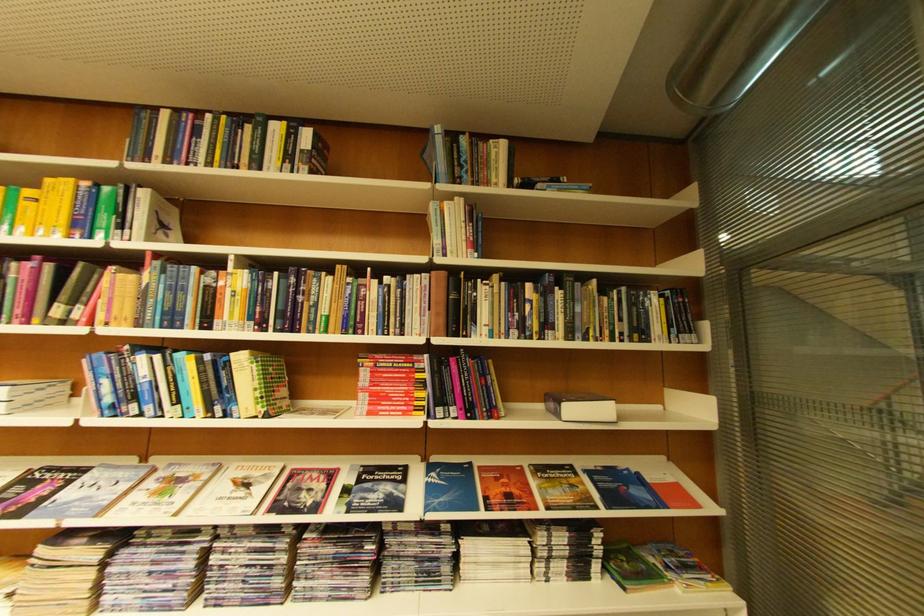
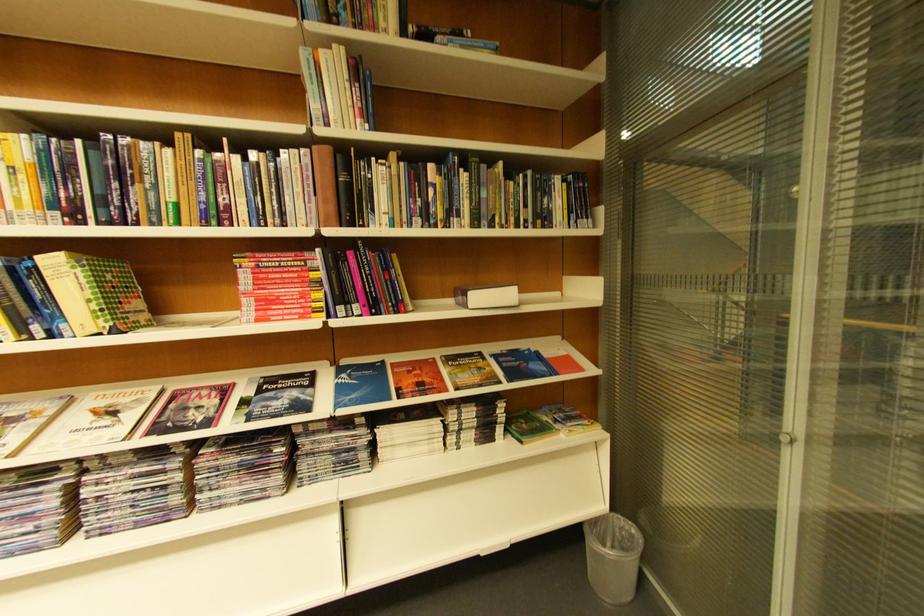
Find the pixel in the second image that matches pixel 396 363 in the first image.

(281, 262)